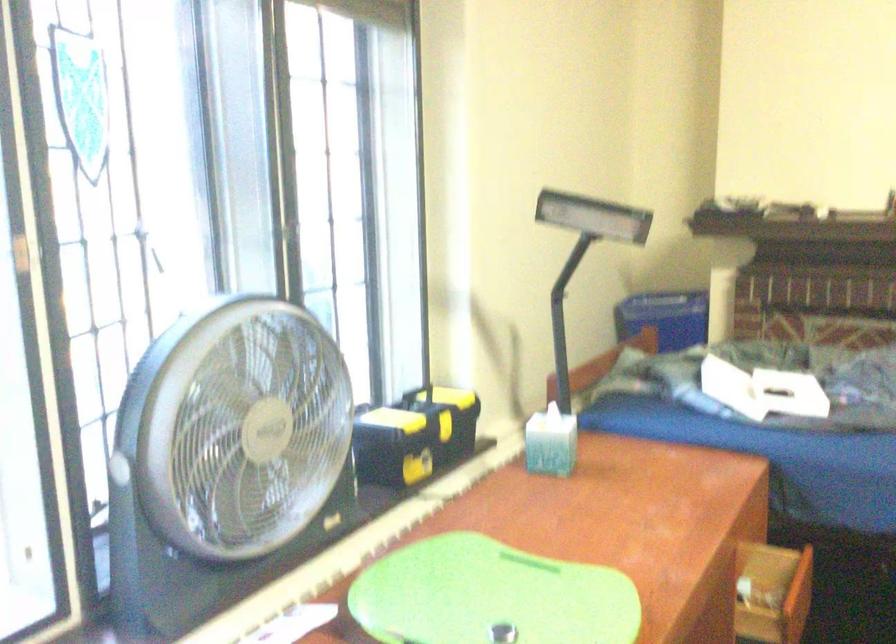
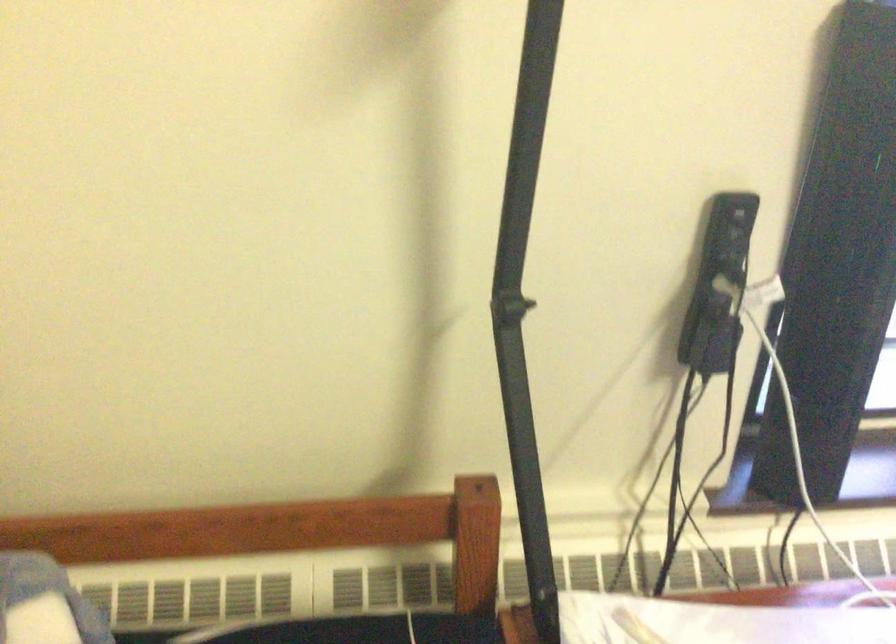
The images are taken continuously from a first-person perspective. In which direction is your viewpoint rotating?

The rotation direction of the camera is left-down.